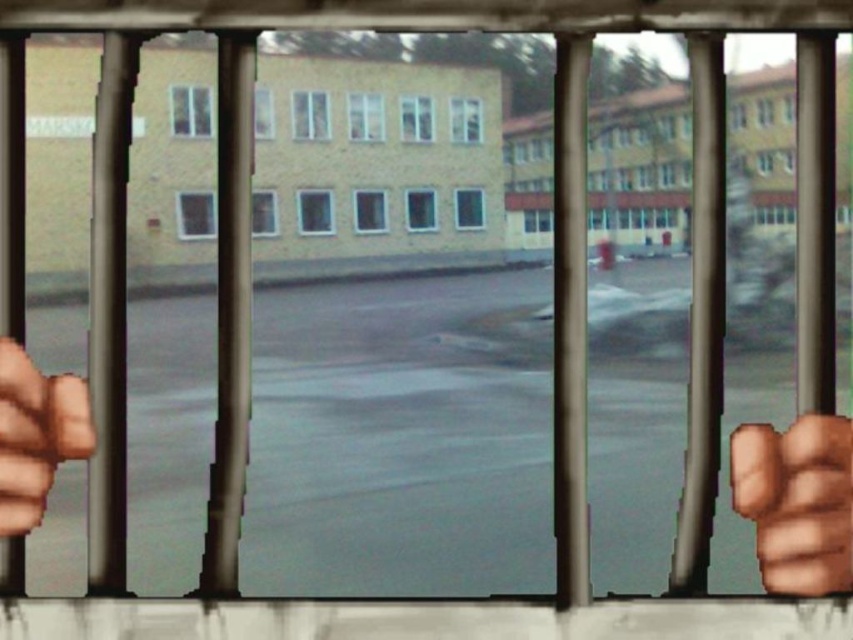
This screenshot has height=640, width=853. What do you see at coordinates (798, 500) in the screenshot?
I see `brown leather fist at right` at bounding box center [798, 500].

Is brown leather fist at right taller than brown leather hand at left?

No.

The height and width of the screenshot is (640, 853). Identify the location of brown leather fist at right. (798, 500).